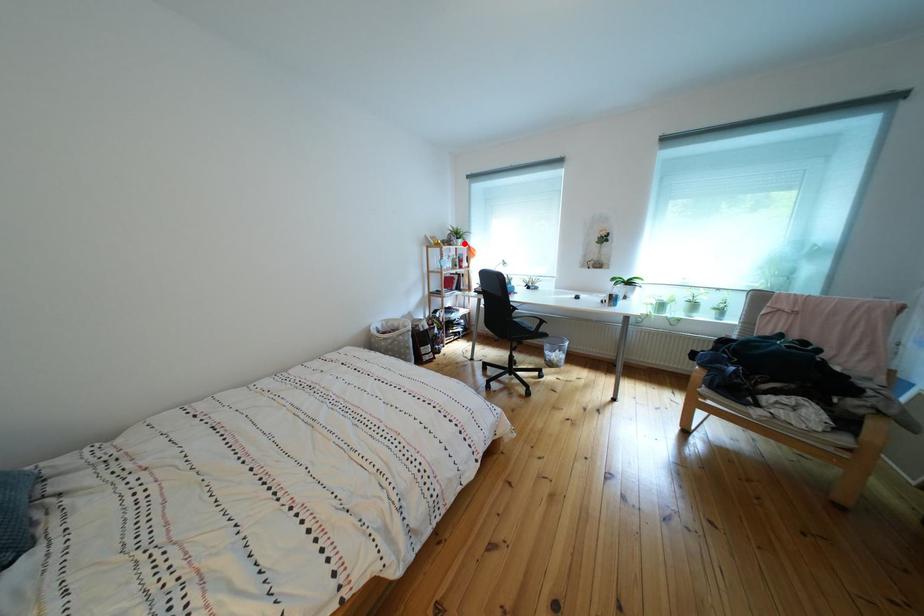
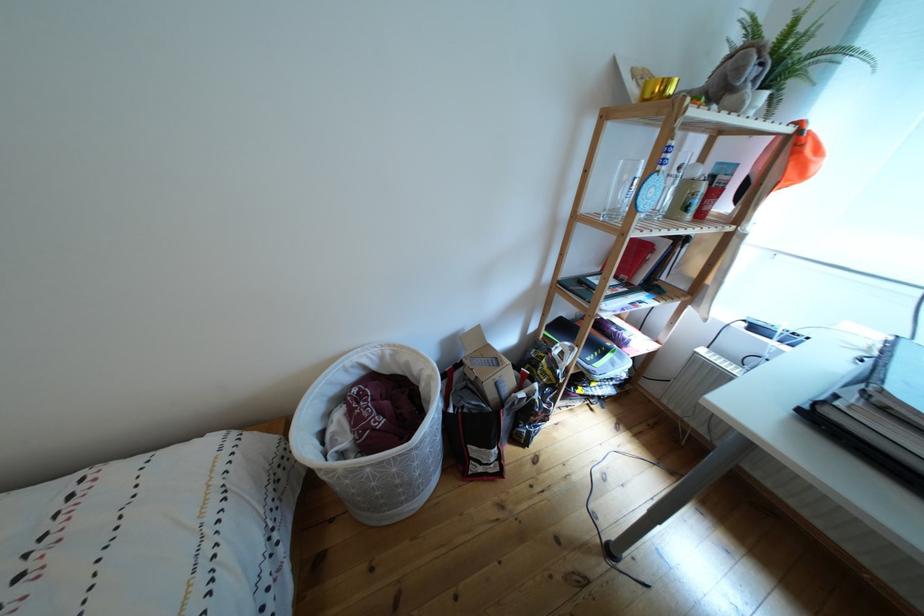
Locate, in the second image, the point that corresponds to the highlighted location in the first image.

(762, 77)